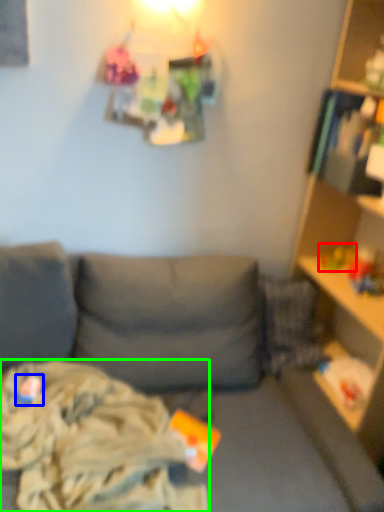
Question: Which is farther away from toy (highlighted by a red box)? toy (highlighted by a blue box) or clothing (highlighted by a green box)?

Choices:
 (A) toy
 (B) clothing

Answer: (A)